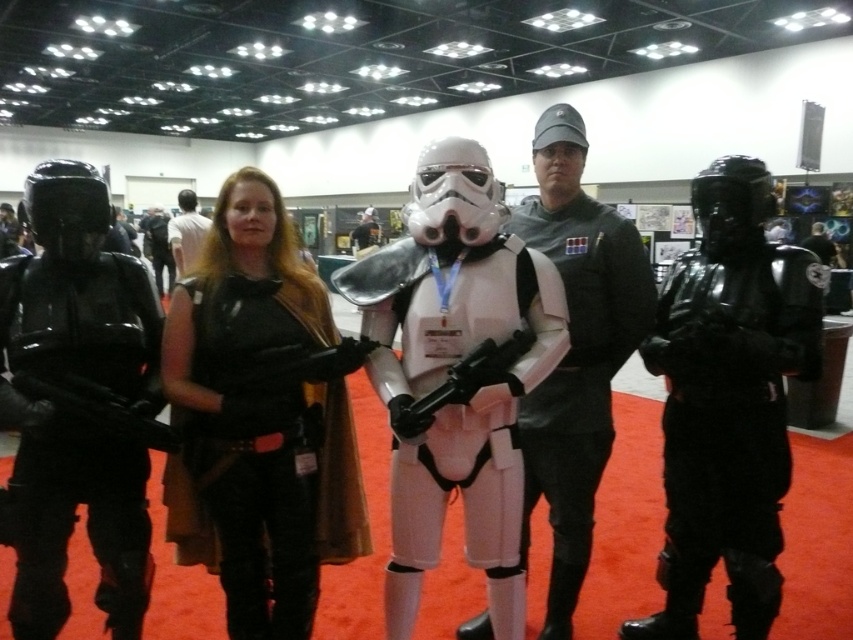
Question: Is shiny black armor at left behind black matte armor at center?

Choices:
 (A) no
 (B) yes

Answer: (A)

Question: Does black leather jacket at center appear on the right side of matte black gun at center?

Choices:
 (A) yes
 (B) no

Answer: (B)

Question: Which of the following is the closest to the observer?

Choices:
 (A) light brown leather jacket at upper left
 (B) shiny black armor at right
 (C) white matte stormtrooper at center
 (D) matte black gun at center

Answer: (D)

Question: Does white matte stormtrooper at center come in front of shiny black armor at left?

Choices:
 (A) yes
 (B) no

Answer: (A)

Question: Which point is closer to the camera taking this photo?

Choices:
 (A) (136, 385)
 (B) (726, 252)
 (C) (381, 301)

Answer: (C)

Question: Among these points, which one is farthest from the camera?

Choices:
 (A) (730, 236)
 (B) (440, 385)
 (C) (30, 205)
 (D) (596, 266)

Answer: (D)